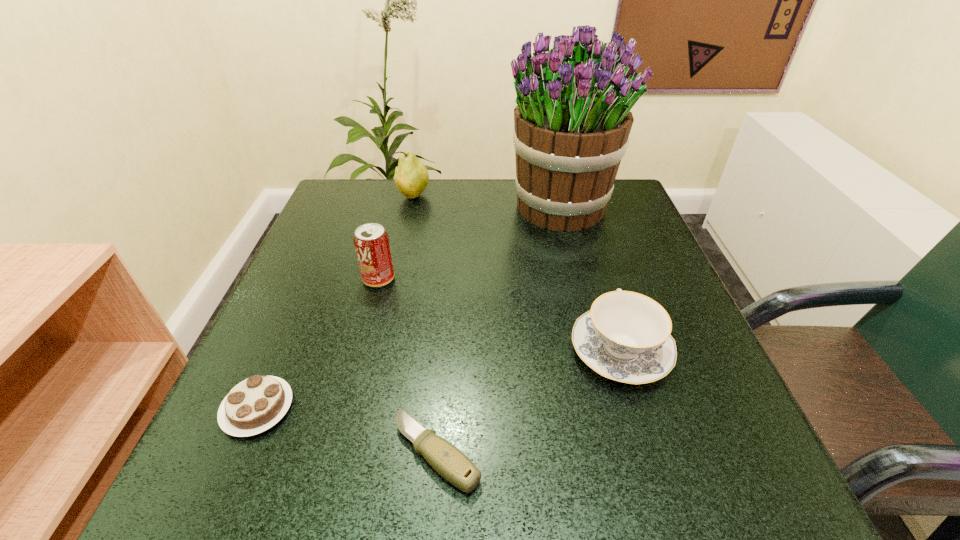
At what (x,y) coordinates should I click in order to perform the action: click on vacant region located 0.360m with the handle on the side of the third shortest object. Please return your answer as a coordinate pair (x, y). Looking at the image, I should click on (577, 209).

Locate an element on the screen. This screenshot has height=540, width=960. vacant region located 0.340m with the handle on the side of the third shortest object is located at coordinates (578, 213).

In order to click on vacant space located with the handle on the side of the third shortest object in this screenshot , I will do `click(590, 254)`.

This screenshot has width=960, height=540. What are the coordinates of `vacant region located on the right of the chocolate cake` in the screenshot? It's located at (550, 408).

Locate an element on the screen. Image resolution: width=960 pixels, height=540 pixels. free location located 0.300m on the right of the shortest object is located at coordinates (696, 453).

Identify the location of bouquet at the far edge. This screenshot has height=540, width=960. (572, 121).

Where is `pear at the far edge`? The height and width of the screenshot is (540, 960). pear at the far edge is located at coordinates (411, 178).

Locate an element on the screen. The width and height of the screenshot is (960, 540). object that is at the near edge is located at coordinates (447, 460).

The height and width of the screenshot is (540, 960). Identify the location of soda can that is positioned at the left edge. (371, 242).

At what (x,y) coordinates should I click in order to perform the action: click on chocolate cake that is at the left edge. Please return your answer as a coordinate pair (x, y). The image size is (960, 540). Looking at the image, I should click on (257, 403).